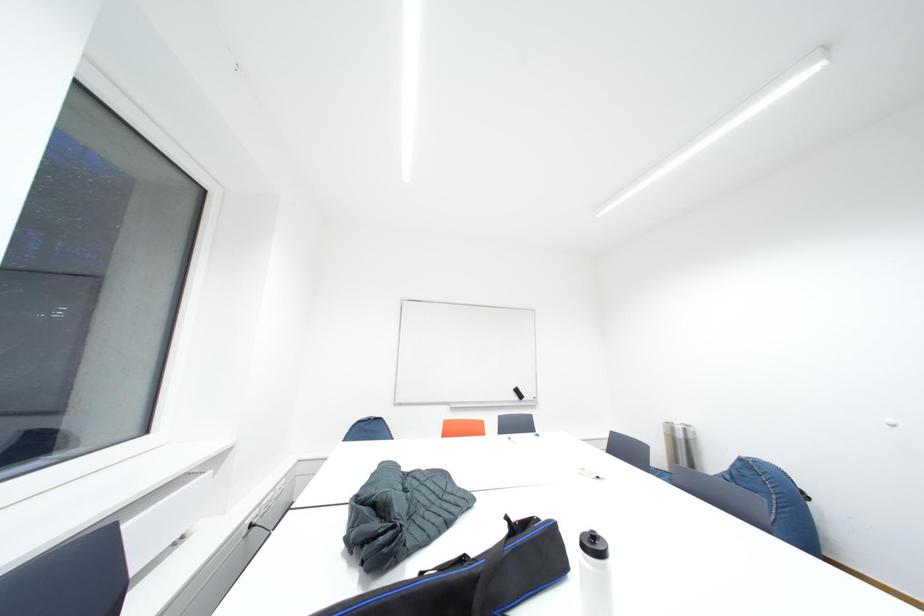
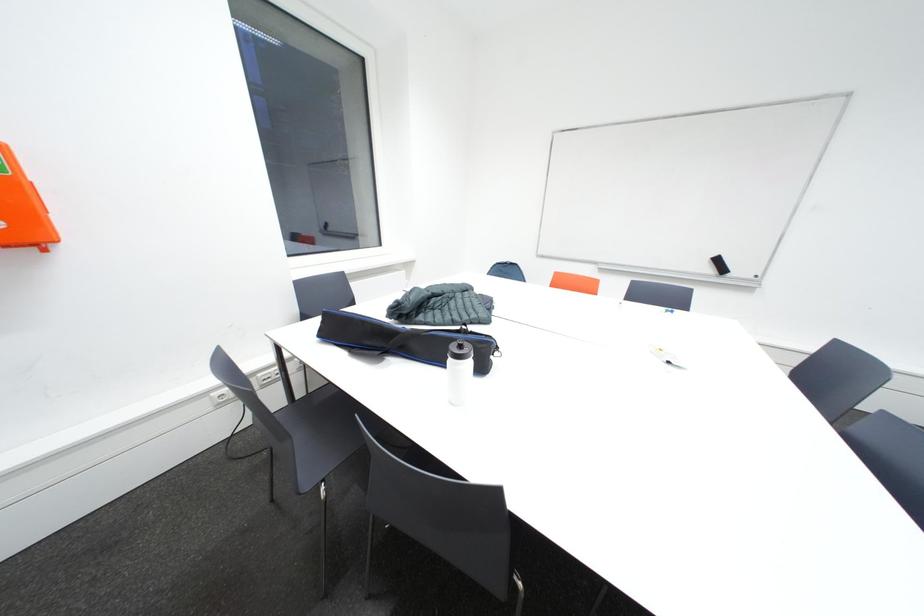
The first image is from the beginning of the video and the second image is from the end. How did the camera likely rotate when shooting the video?

The camera's rotation is toward left-down.